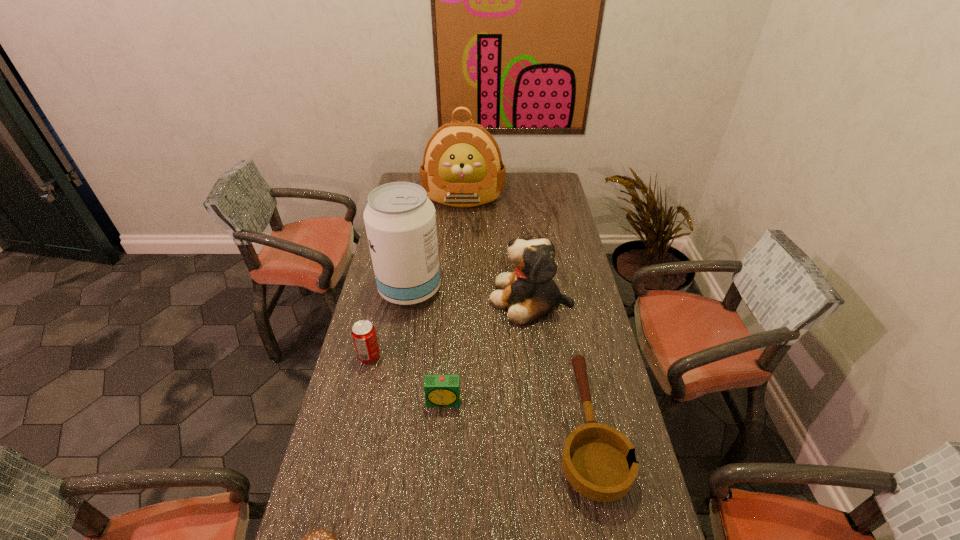
In order to click on vacant space located 0.270m at the face of the puppy in this screenshot , I will do `click(418, 299)`.

You are a GUI agent. You are given a task and a screenshot of the screen. Output one action in this format:
    pyautogui.click(x=<x>, y=<y>)
    Task: Click on the vacant space located at the face of the puppy
    The width and height of the screenshot is (960, 540).
    Given the screenshot: What is the action you would take?
    pyautogui.click(x=386, y=299)

This screenshot has height=540, width=960. Find the location of `vacant point located 0.170m on the back of the fourth shortest object`. vacant point located 0.170m on the back of the fourth shortest object is located at coordinates (380, 312).

The width and height of the screenshot is (960, 540). I want to click on vacant space situated on the front-facing side of the fifth tallest object, so 439,474.

Find the location of a particular element. The image size is (960, 540). blank space located with the handle on the side of the saucepan is located at coordinates (561, 296).

Locate an element on the screen. blank area located with the handle on the side of the saucepan is located at coordinates (564, 312).

The height and width of the screenshot is (540, 960). In order to click on vacant space located with the handle on the side of the saucepan in this screenshot , I will do `click(564, 312)`.

Locate an element on the screen. object present at the far edge is located at coordinates (462, 166).

Locate an element on the screen. This screenshot has height=540, width=960. backpack positioned at the left edge is located at coordinates (462, 166).

The width and height of the screenshot is (960, 540). Find the location of `alcohol located in the left edge section of the desktop`. alcohol located in the left edge section of the desktop is located at coordinates (400, 220).